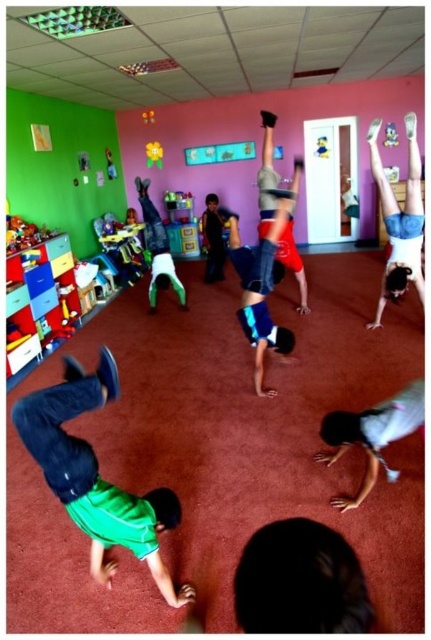
Question: Which of the following is the closest to the observer?

Choices:
 (A) plastic yellow toy at lower left
 (B) denim shorts at upper right
 (C) yellow plush duck at upper center
 (D) green matte shirt at lower left

Answer: (D)

Question: From the image, what is the correct spatial relationship of yellow fabric flower at upper center in relation to rubberized yellow ball at center?

Choices:
 (A) right
 (B) left

Answer: (A)

Question: Among these points, which one is farthest from the camera?

Choices:
 (A) 387,417
 (B) 394,129
 (C) 153,141

Answer: (C)

Question: Can you confirm if white fabric shirt at lower center is smaller than yellow plush duck at upper center?

Choices:
 (A) yes
 (B) no

Answer: (B)

Question: Which object appears farthest from the camera in this image?

Choices:
 (A) white fabric shirt at lower center
 (B) reddish-brown fabric shorts at center
 (C) rubberized yellow ball at center
 (D) yellow plush duck at upper center

Answer: (C)

Question: Can you confirm if reddish-brown fabric shorts at center is positioned below rubberized yellow ball at center?

Choices:
 (A) yes
 (B) no

Answer: (A)